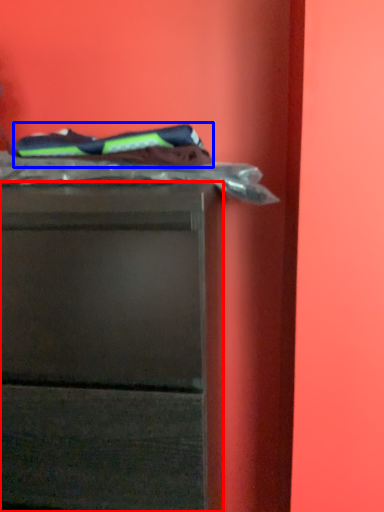
Question: Which object is further to the camera taking this photo, chest of drawers (highlighted by a red box) or laundry (highlighted by a blue box)?

Choices:
 (A) chest of drawers
 (B) laundry

Answer: (B)